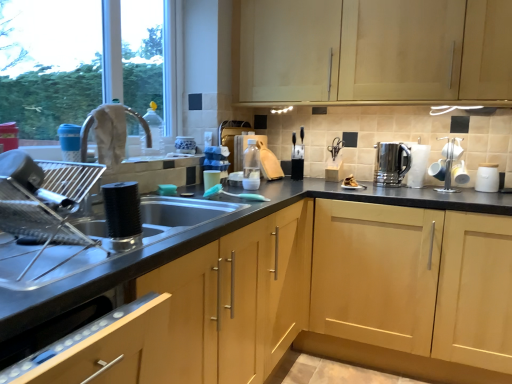
Question: Based on their sizes in the image, would you say matte plastic cup at sink, the fourth appliance from the right, is bigger or smaller than stainless steel kettle at right?

Choices:
 (A) small
 (B) big

Answer: (A)

Question: Would you say matte plastic cup at sink, which appears as the 4th appliance when viewed from the back, is to the left or to the right of stainless steel kettle at right in the picture?

Choices:
 (A) left
 (B) right

Answer: (A)

Question: Estimate the real-world distances between objects in this image. Which object is farther from the light wood cabinet at upper center, the 1th cabinetry when ordered from top to bottom?

Choices:
 (A) matte silver faucet at upper left
 (B) matte plastic cup at sink, which appears as the 4th appliance when viewed from the back
 (C) translucent plastic bottle at center, placed as the second bottle when sorted from front to back
 (D) silver metallic toaster at upper right, which ranks as the third appliance in right-to-left order
 (E) white glossy mugs at right, which is the 3th appliance in back-to-front order

Answer: (A)

Question: Considering the real-world distances, which object is closest to the matte silver faucet at upper left?

Choices:
 (A) light wood cabinet at center, placed as the 3th cabinetry when sorted from top to bottom
 (B) white matte jar at right, the third appliance viewed from the front
 (C) light wood cabinet at center, placed as the 2th cabinetry when sorted from top to bottom
 (D) stainless steel kettle at right
 (E) transparent plastic bottle at upper center, which is the first bottle from left to right

Answer: (E)